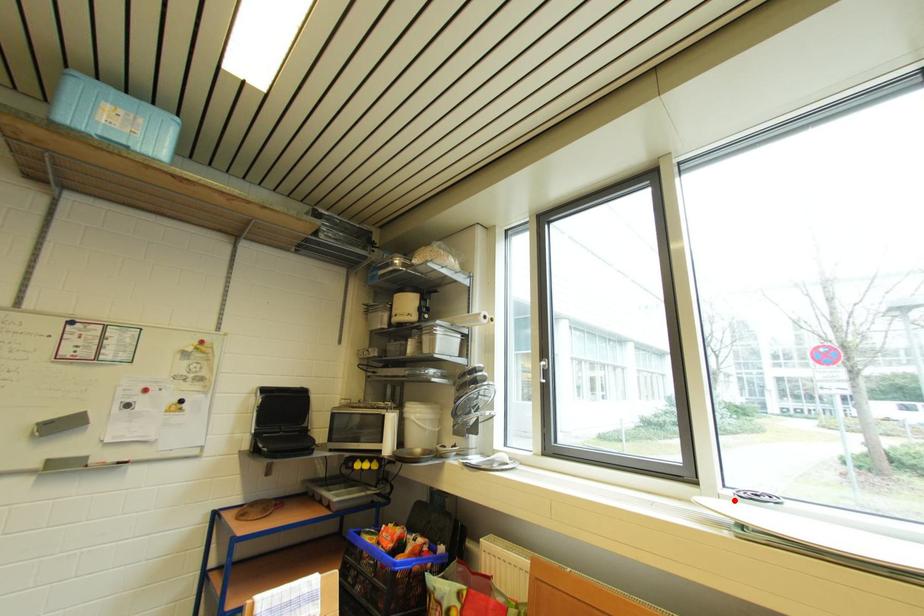
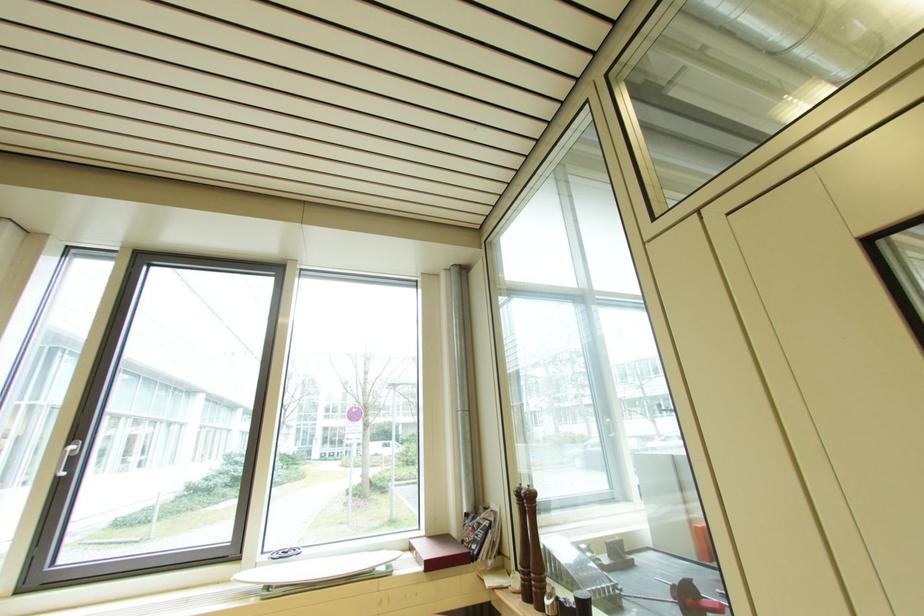
The point at the highlighted location is marked in the first image. Where is the corresponding point in the second image?

(271, 567)